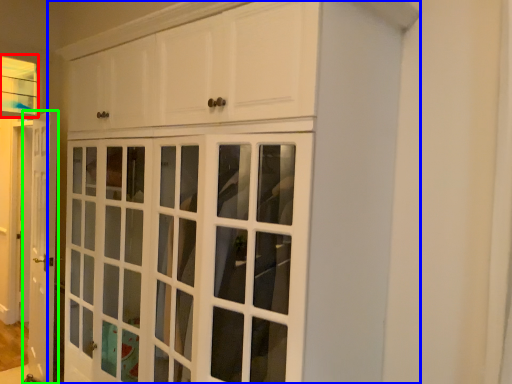
Question: Which object is positioned closest to window (highlighted by a red box)? Select from cupboard (highlighted by a blue box) and door (highlighted by a green box).

Choices:
 (A) cupboard
 (B) door

Answer: (B)